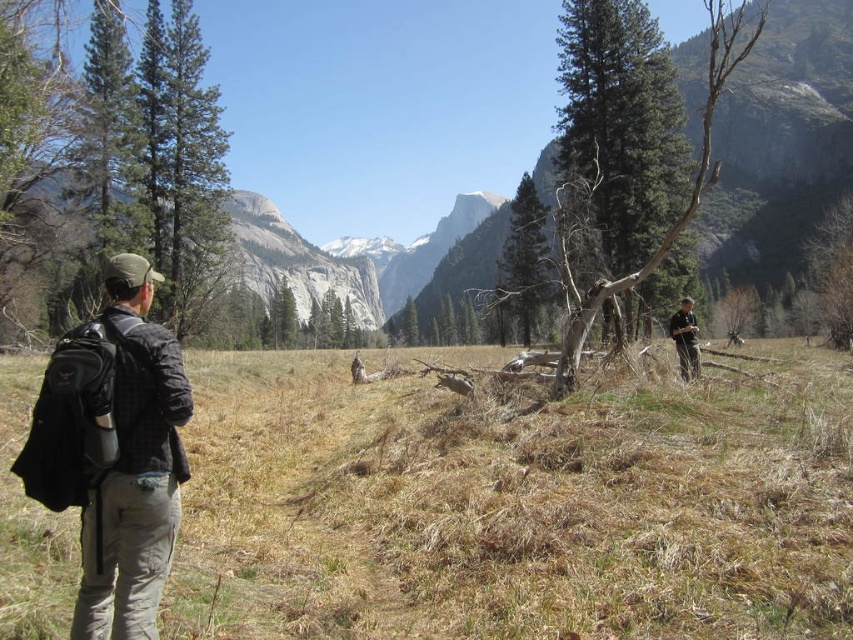
You are a hiker planning to cross the field in the image. You see the brown grass at center and the green textured pine tree at center. Which one is taller?

The green textured pine tree at center is taller than the brown grass at center.

You are planning a hiking route through this mountainous area and need to cross the field. You see the brown grass at center and the green textured pine tree at center. Which object is shorter and might be easier to step over while hiking?

The brown grass at center is not as tall as the green textured pine tree at center, so the brown grass at center is shorter and easier to step over while hiking.

You are hiking in this mountainous area and see a green textured pine tree at center and a dark brown leather jacket at right. Which object is positioned to the left?

The green textured pine tree at center is positioned to the left of the dark brown leather jacket at right.